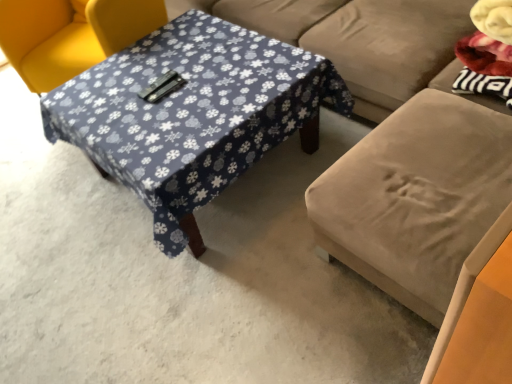
Locate an element on the screen. This screenshot has height=384, width=512. free space above blue fabric-covered table at center (from a real-world perspective) is located at coordinates (166, 91).